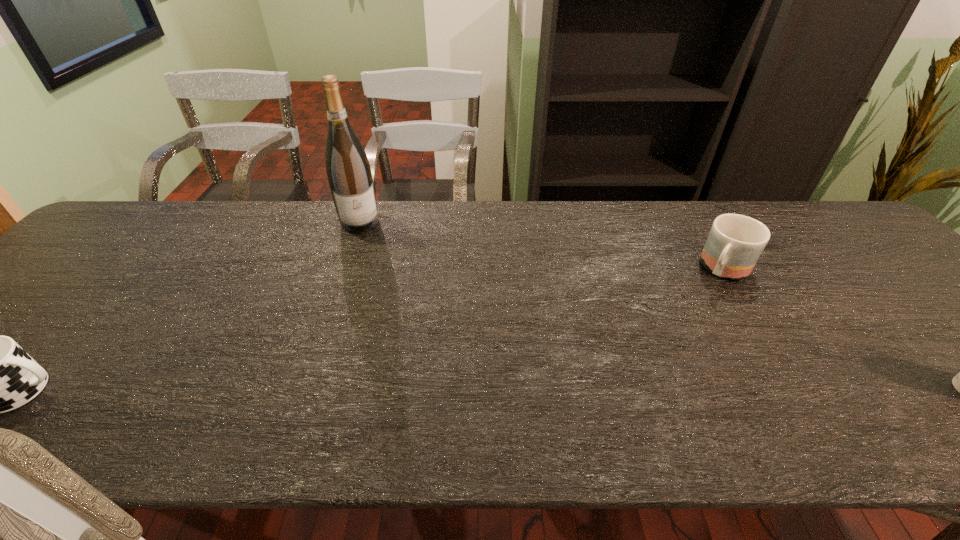
Where is `mug`? mug is located at coordinates (735, 242).

The image size is (960, 540). I want to click on the rightmost object, so click(x=735, y=242).

Find the location of a particular element. Image resolution: width=960 pixels, height=540 pixels. wine bottle is located at coordinates (349, 174).

Identify the location of the tallest object. The height and width of the screenshot is (540, 960). (349, 174).

The width and height of the screenshot is (960, 540). I want to click on vacant position located 0.090m on the side with the handle of the mug, so click(x=700, y=302).

Find the location of a particular element. The height and width of the screenshot is (540, 960). blank space located 0.290m on the side with the handle of the mug is located at coordinates (665, 350).

The image size is (960, 540). In order to click on vacant space located on the side with the handle of the mug in this screenshot , I will do `click(659, 358)`.

Identify the location of free space located 0.390m on the label of the wine bottle. This screenshot has width=960, height=540. (389, 327).

Find the location of a particular element. vacant space situated on the label of the wine bottle is located at coordinates [381, 299].

At what (x,y) coordinates should I click in order to perform the action: click on vacant area situated 0.400m on the label of the wine bottle. Please return your answer as a coordinate pair (x, y). Looking at the image, I should click on (390, 330).